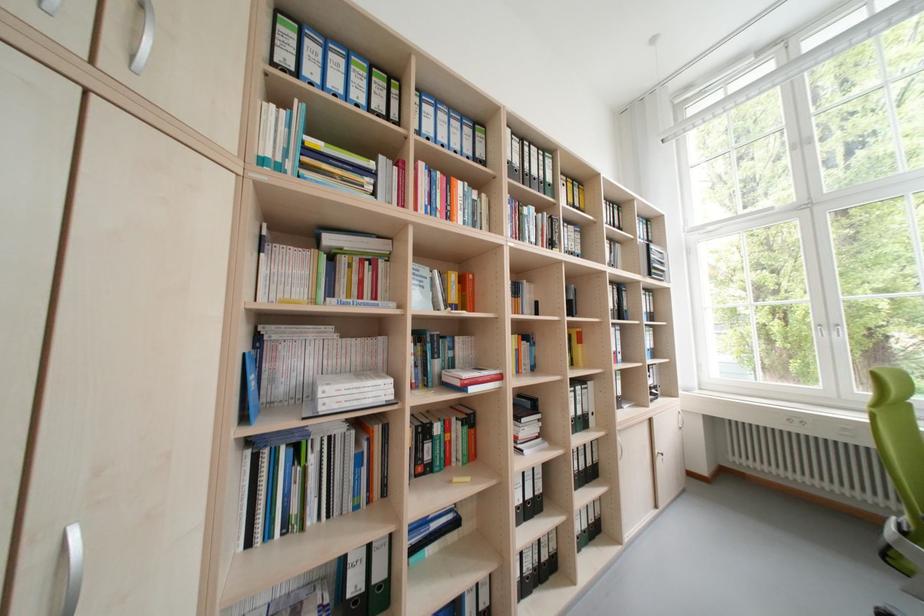
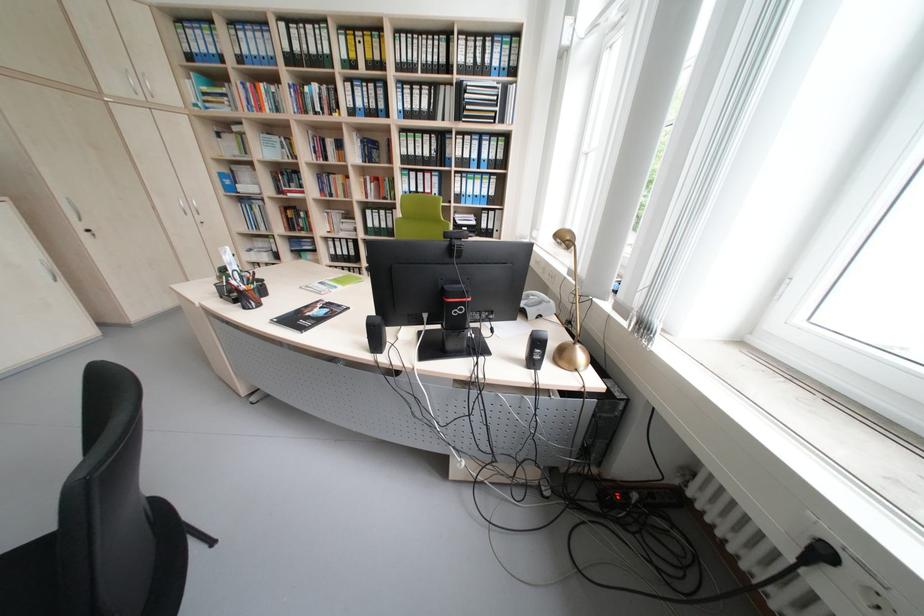
Find the pixel in the second image that matches point (434, 273) in the first image.

(286, 140)